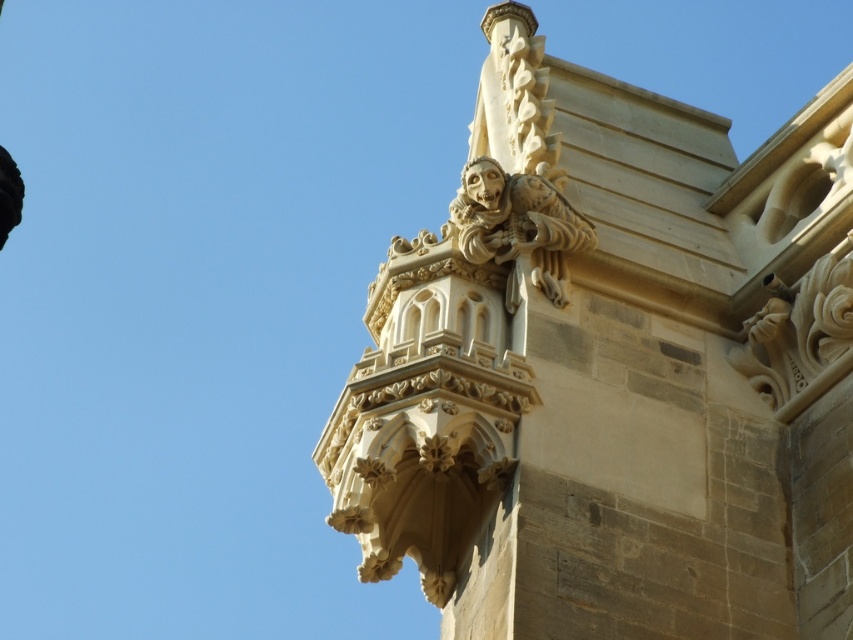
Question: Is beige stone gargoyle at upper right below beige stone gargoyle at upper center?

Choices:
 (A) no
 (B) yes

Answer: (B)

Question: Does beige stone gargoyle at upper right have a smaller size compared to beige stone gargoyle at upper center?

Choices:
 (A) no
 (B) yes

Answer: (A)

Question: Does beige stone gargoyle at upper right appear on the left side of beige stone gargoyle at upper center?

Choices:
 (A) yes
 (B) no

Answer: (B)

Question: Which point appears farthest from the camera in this image?

Choices:
 (A) coord(704,227)
 (B) coord(532,205)

Answer: (A)

Question: Among these objects, which one is nearest to the camera?

Choices:
 (A) beige stone gargoyle at upper center
 (B) beige stone gargoyle at upper right

Answer: (B)

Question: Which of the following is the closest to the observer?

Choices:
 (A) click(x=733, y=595)
 (B) click(x=589, y=221)

Answer: (A)